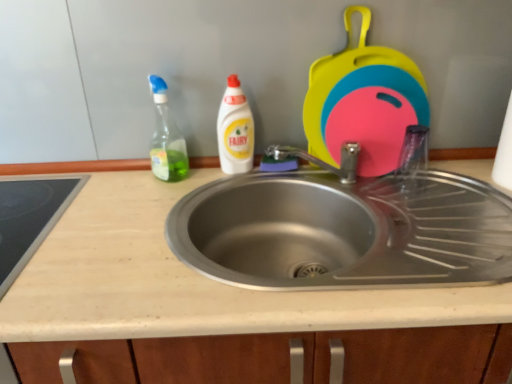
Question: Is rubberized plastic cutting boards at upper right, which appears as the first appliance when viewed from the right, smaller than beige laminate countertop at center?

Choices:
 (A) yes
 (B) no

Answer: (A)

Question: From the image's perspective, is rubberized plastic cutting boards at upper right, which appears as the first appliance when viewed from the right, below beige laminate countertop at center?

Choices:
 (A) no
 (B) yes

Answer: (A)

Question: Is rubberized plastic cutting boards at upper right, acting as the first appliance starting from the top, to the left of beige laminate countertop at center from the viewer's perspective?

Choices:
 (A) yes
 (B) no

Answer: (B)

Question: Can you confirm if rubberized plastic cutting boards at upper right, which is counted as the second appliance, starting from the left, is thinner than beige laminate countertop at center?

Choices:
 (A) no
 (B) yes

Answer: (B)

Question: Is rubberized plastic cutting boards at upper right, positioned as the 2th appliance in bottom-to-top order, not close to beige laminate countertop at center?

Choices:
 (A) no
 (B) yes

Answer: (A)

Question: Does rubberized plastic cutting boards at upper right, which is counted as the second appliance, starting from the left, lie in front of beige laminate countertop at center?

Choices:
 (A) no
 (B) yes

Answer: (A)

Question: Is beige laminate countertop at center behind smooth glass cooktop at left, the first appliance positioned from the bottom?

Choices:
 (A) yes
 (B) no

Answer: (B)

Question: Does beige laminate countertop at center turn towards smooth glass cooktop at left, the first appliance positioned from the bottom?

Choices:
 (A) yes
 (B) no

Answer: (B)

Question: Is smooth glass cooktop at left, the 1th appliance positioned from the left, surrounded by beige laminate countertop at center?

Choices:
 (A) no
 (B) yes

Answer: (B)

Question: Is beige laminate countertop at center positioned beyond the bounds of smooth glass cooktop at left, the first appliance positioned from the bottom?

Choices:
 (A) no
 (B) yes

Answer: (B)

Question: Is smooth glass cooktop at left, the 2th appliance viewed from the top, at the back of beige laminate countertop at center?

Choices:
 (A) no
 (B) yes

Answer: (A)

Question: Does beige laminate countertop at center have a lesser height compared to smooth glass cooktop at left, the first appliance positioned from the bottom?

Choices:
 (A) no
 (B) yes

Answer: (A)

Question: Is beige laminate countertop at center thinner than white glossy bottle at center, which appears as the first cleaning product when viewed from the right?

Choices:
 (A) no
 (B) yes

Answer: (A)